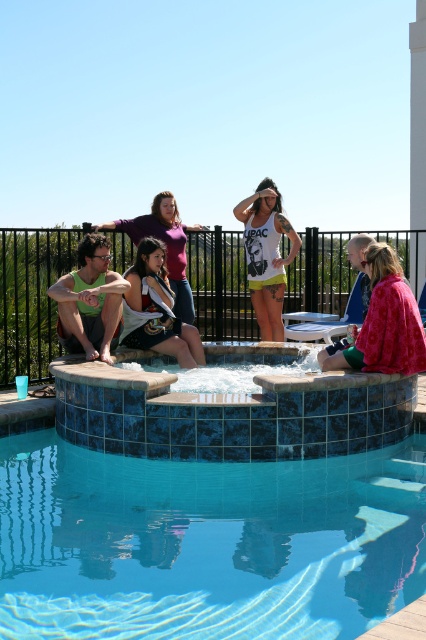
Is blue tile swimming pool at lower center further to the viewer compared to white matte tank top at center?

No, it is not.

Can you confirm if blue tile swimming pool at lower center is taller than white matte tank top at center?

Incorrect, blue tile swimming pool at lower center's height is not larger of white matte tank top at center's.

Which is behind, point (218, 486) or point (264, 216)?

The point (264, 216) is more distant.

Where is `blue tile swimming pool at lower center`? The width and height of the screenshot is (426, 640). blue tile swimming pool at lower center is located at coordinates (206, 544).

Looking at this image, between floral fabric jacket at lower right and matte purple tank top at center, which one has less height?

With less height is floral fabric jacket at lower right.

Can you confirm if floral fabric jacket at lower right is bigger than matte purple tank top at center?

Actually, floral fabric jacket at lower right might be smaller than matte purple tank top at center.

Locate an element on the screen. The image size is (426, 640). floral fabric jacket at lower right is located at coordinates (383, 323).

Describe the element at coordinates (89, 300) in the screenshot. I see `green matte tank top at left` at that location.

Is green matte tank top at left wider than matte purple tank top at center?

No, green matte tank top at left is not wider than matte purple tank top at center.

Is point (103, 339) positioned in front of point (121, 224)?

Yes, it is.

At what (x,y) coordinates should I click in order to perform the action: click on green matte tank top at left. Please return your answer as a coordinate pair (x, y). Image resolution: width=426 pixels, height=640 pixels. Looking at the image, I should click on (89, 300).